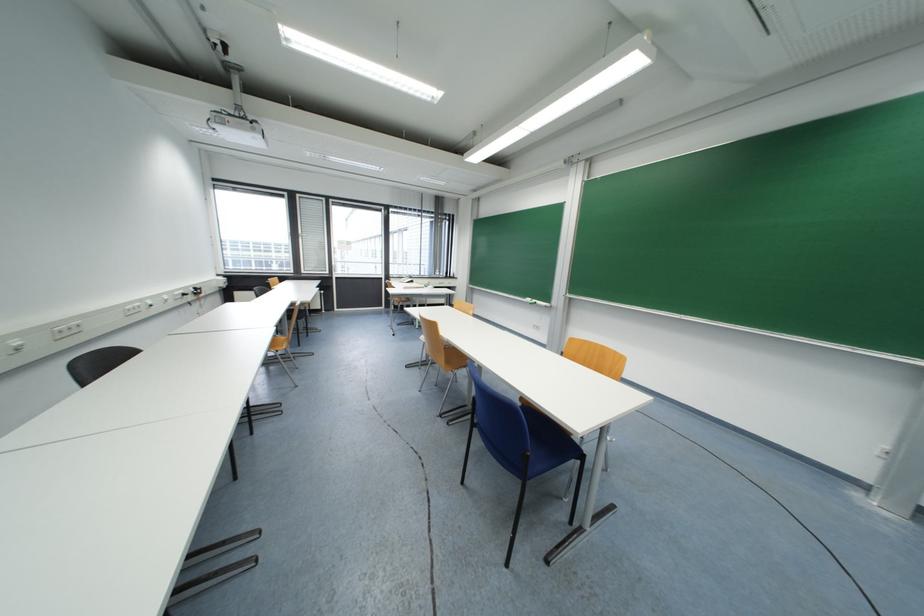
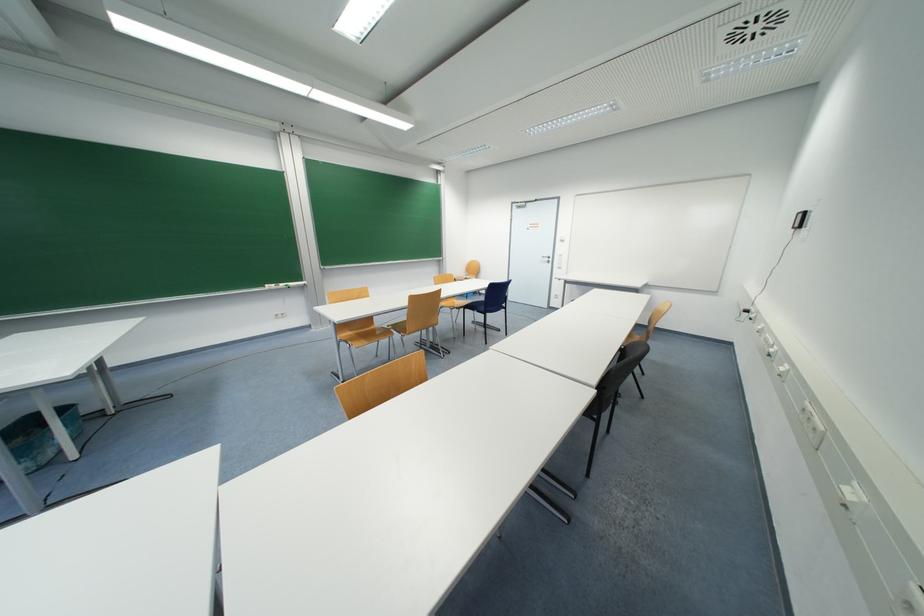
Locate, in the second image, the point that corresponds to (539,302) in the first image.

(286, 286)